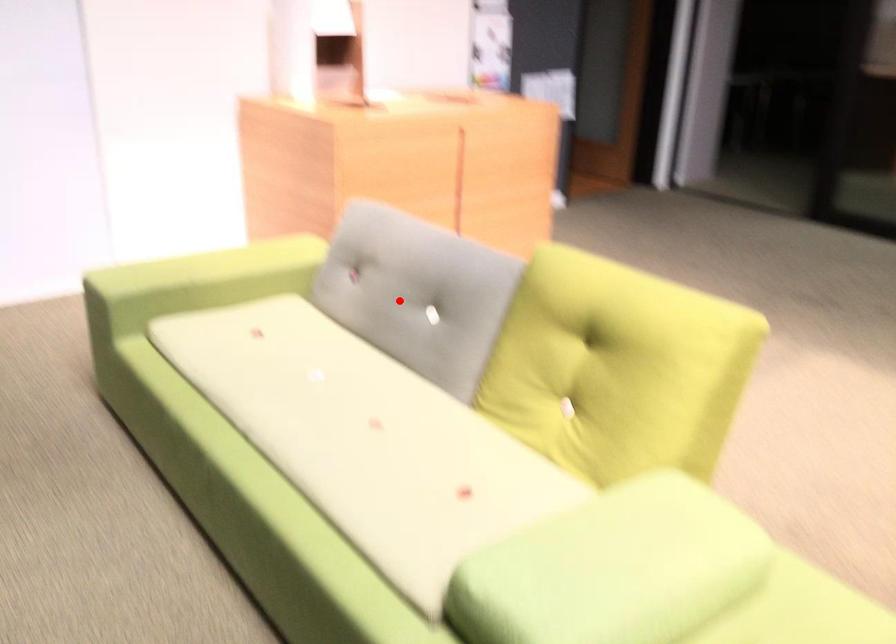
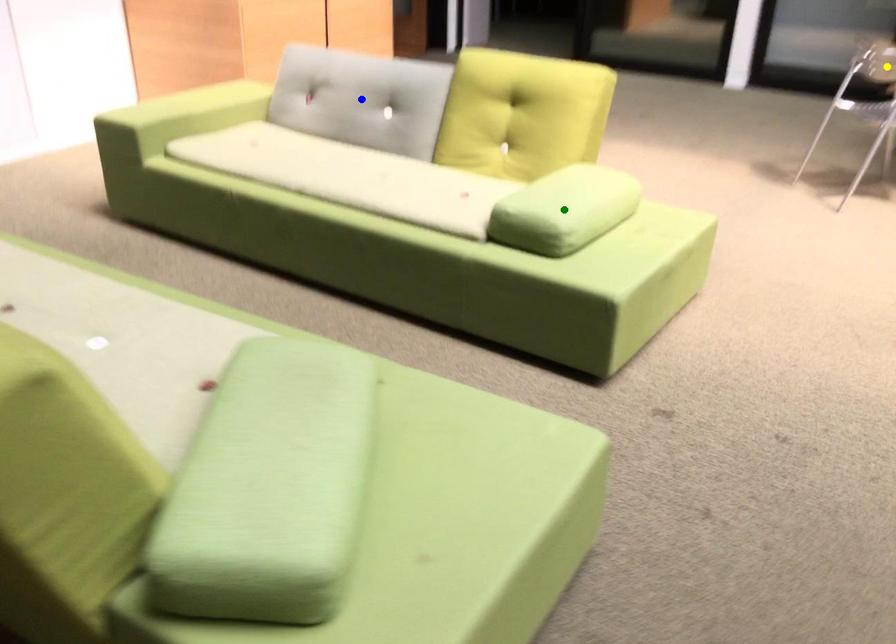
Question: I am providing you with two images of the same scene from different viewpoints. A red point is marked on the first image. You are given multiple points on the second image. Which point in image 2 is actually the same real-world point as the red point in image 1?

Choices:
 (A) yellow point
 (B) blue point
 (C) green point

Answer: (B)